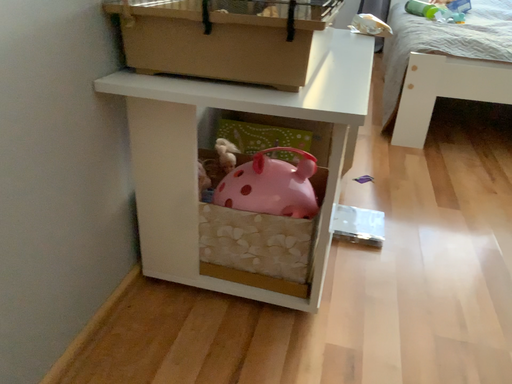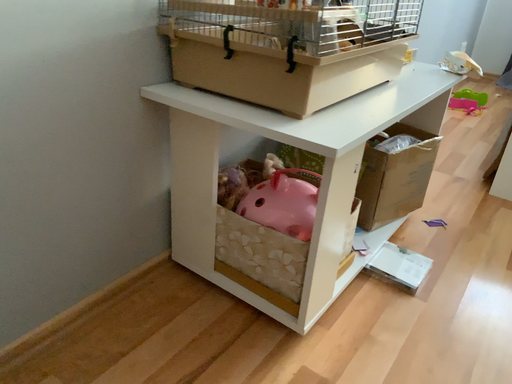
Question: How did the camera likely rotate when shooting the video?

Choices:
 (A) rotated left
 (B) rotated right

Answer: (A)